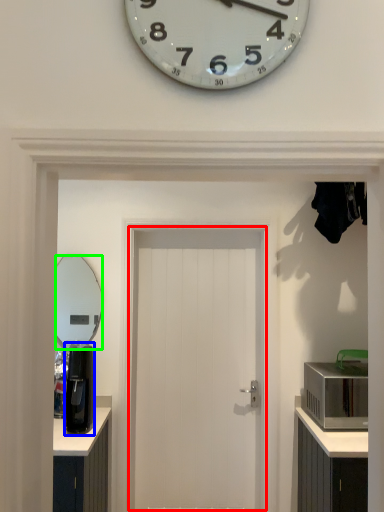
Question: Based on their relative distances, which object is farther from door (highlighted by a red box)? Choose from coffee machine (highlighted by a blue box) and mirror (highlighted by a green box).

Choices:
 (A) coffee machine
 (B) mirror

Answer: (B)